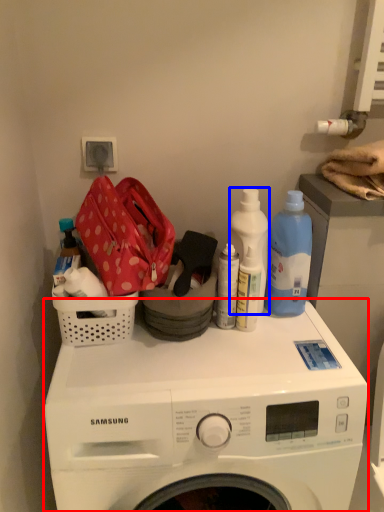
Question: Which of the following is the farthest to the observer, washing machine (highlighted by a red box) or cleaning product (highlighted by a blue box)?

Choices:
 (A) washing machine
 (B) cleaning product

Answer: (B)